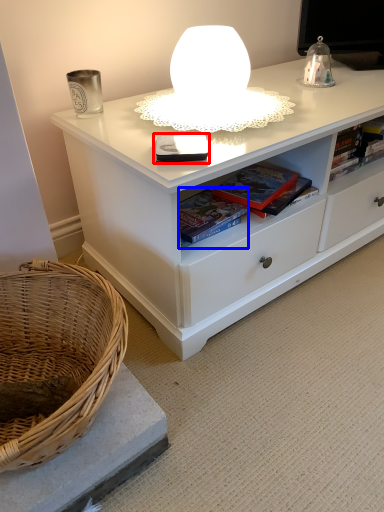
Question: Which of the following is the farthest to the observer, book (highlighted by a red box) or book (highlighted by a blue box)?

Choices:
 (A) book
 (B) book

Answer: (B)